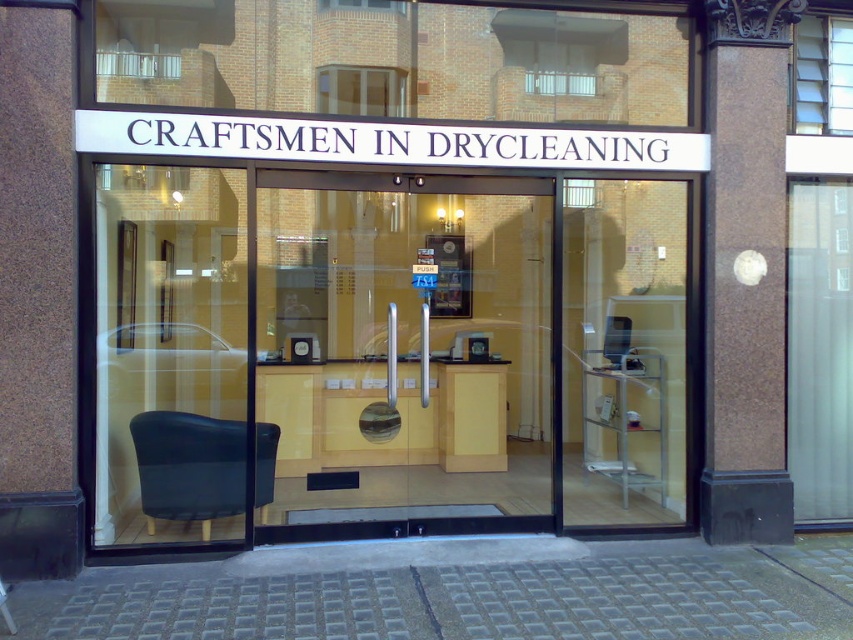
Question: Is matte wood counter at center below matte black chair at left?

Choices:
 (A) no
 (B) yes

Answer: (A)

Question: Based on their relative distances, which object is farther from the matte wood counter at center?

Choices:
 (A) transparent glass door at left
 (B) matte black chair at left
 (C) transparent glass door at center

Answer: (B)

Question: Which object is the farthest from the transparent glass door at left?

Choices:
 (A) matte black chair at left
 (B) transparent glass door at center
 (C) matte wood counter at center

Answer: (C)

Question: Is the position of matte wood counter at center more distant than that of transparent glass door at center?

Choices:
 (A) yes
 (B) no

Answer: (A)

Question: Which point is farther from the camera taking this photo?

Choices:
 (A) 189,378
 (B) 511,339
 (C) 189,436
 (D) 396,202

Answer: (B)

Question: Is transparent glass door at center bigger than transparent glass door at left?

Choices:
 (A) yes
 (B) no

Answer: (A)